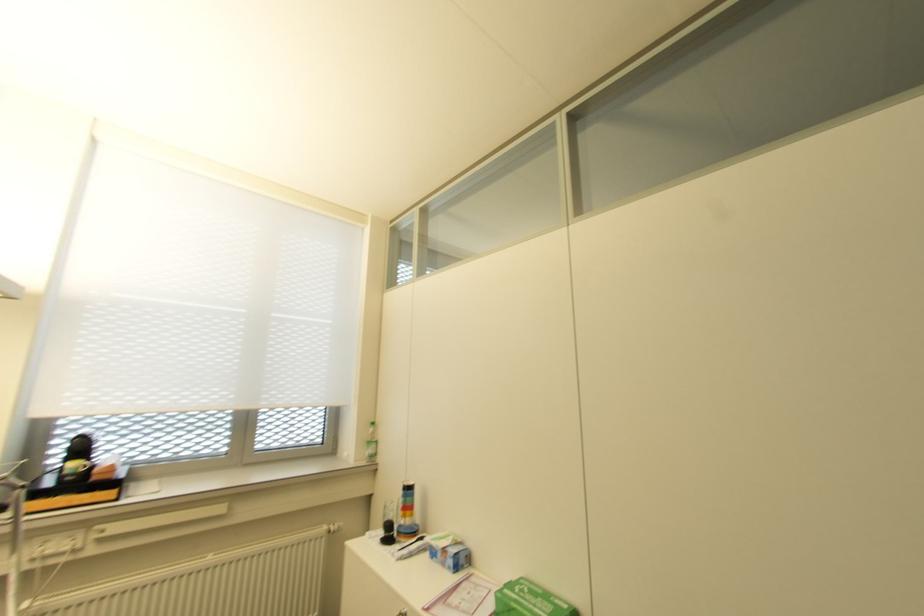
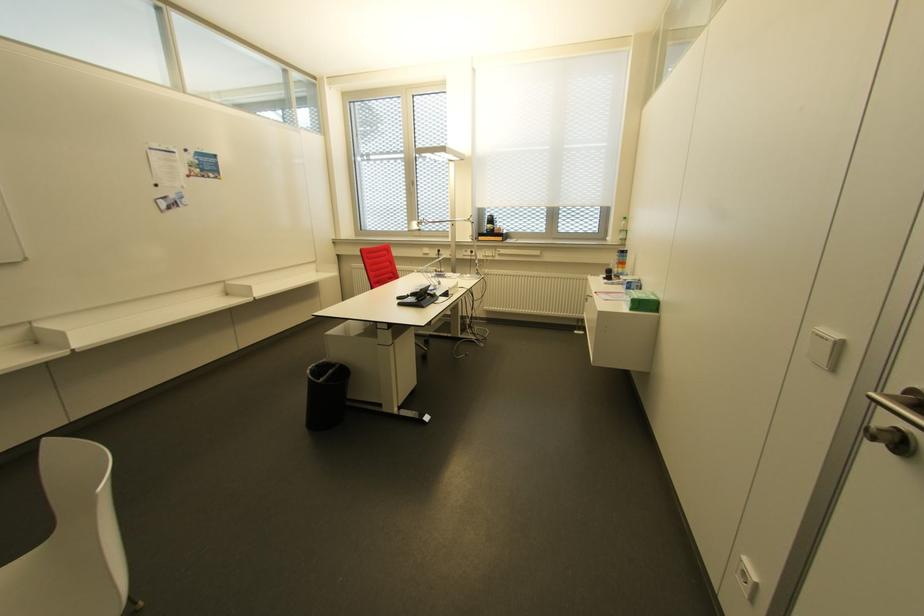
The point at [372,455] is marked in the first image. Where is the corresponding point in the second image?

(623, 240)